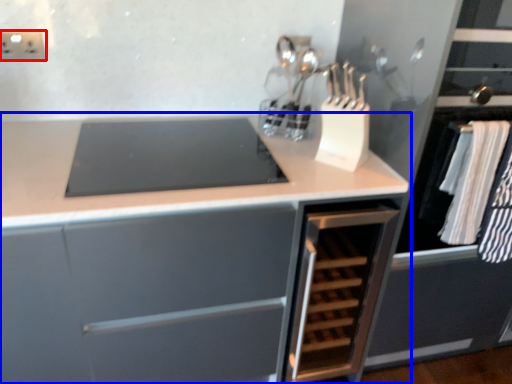
Question: Which of the following is the farthest to the observer, electric outlet (highlighted by a red box) or cabinetry (highlighted by a blue box)?

Choices:
 (A) electric outlet
 (B) cabinetry

Answer: (A)